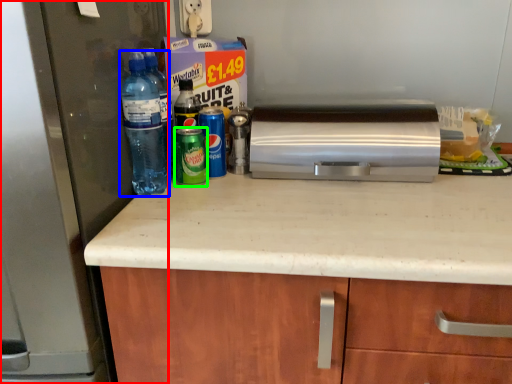
Question: Based on their relative distances, which object is nearer to refrigerator (highlighted by a red box)? Choose from bottle (highlighted by a blue box) and beverage (highlighted by a green box).

Choices:
 (A) bottle
 (B) beverage

Answer: (A)